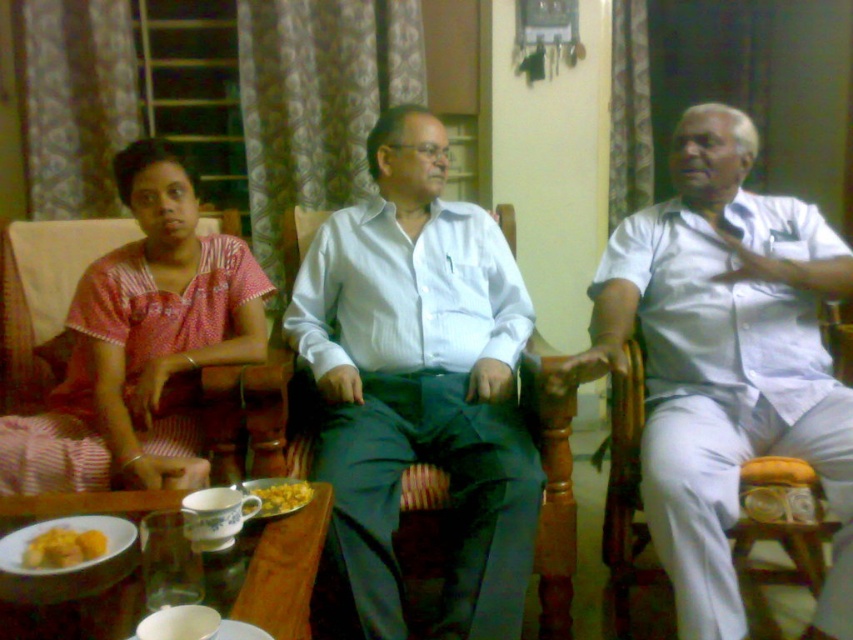
Who is positioned more to the left, yellow matte bread at lower left or yellow matte food at center?

yellow matte bread at lower left

Looking at this image, does yellow matte bread at lower left have a greater width compared to yellow matte food at center?

In fact, yellow matte bread at lower left might be narrower than yellow matte food at center.

Where is `yellow matte bread at lower left`? yellow matte bread at lower left is located at coordinates (62, 547).

Which of these two, white cotton shirt at center or pink striped dress at left, stands taller?

white cotton shirt at center

Is point (821, 285) farther from camera compared to point (186, 364)?

No, (821, 285) is in front of (186, 364).

Is point (770, 448) farther from camera compared to point (206, 314)?

No, (770, 448) is closer to viewer.

This screenshot has width=853, height=640. I want to click on white cotton shirt at center, so click(724, 362).

Can you confirm if white smooth shirt at center is positioned to the right of yellow matte bread at lower left?

Correct, you'll find white smooth shirt at center to the right of yellow matte bread at lower left.

Is white smooth shirt at center taller than yellow matte bread at lower left?

Correct, white smooth shirt at center is much taller as yellow matte bread at lower left.

Is point (428, 152) less distant than point (45, 541)?

That is False.

What are the coordinates of `white smooth shirt at center` in the screenshot? It's located at (421, 381).